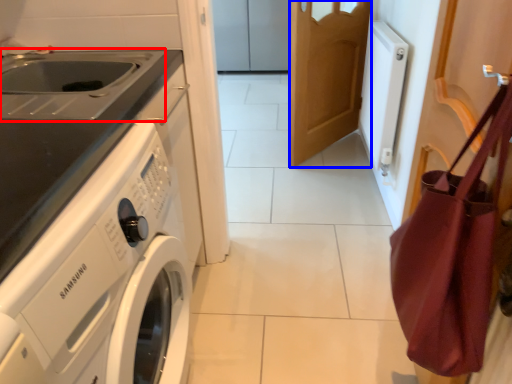
Question: Among these objects, which one is farthest to the camera, sink (highlighted by a red box) or door (highlighted by a blue box)?

Choices:
 (A) sink
 (B) door

Answer: (B)